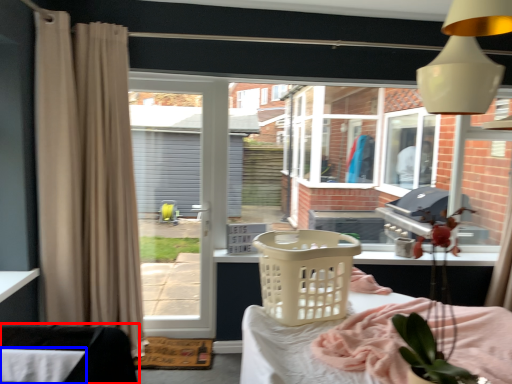
Question: Which object appears farthest to the camera in this image, furniture (highlighted by a red box) or table (highlighted by a blue box)?

Choices:
 (A) furniture
 (B) table

Answer: (A)